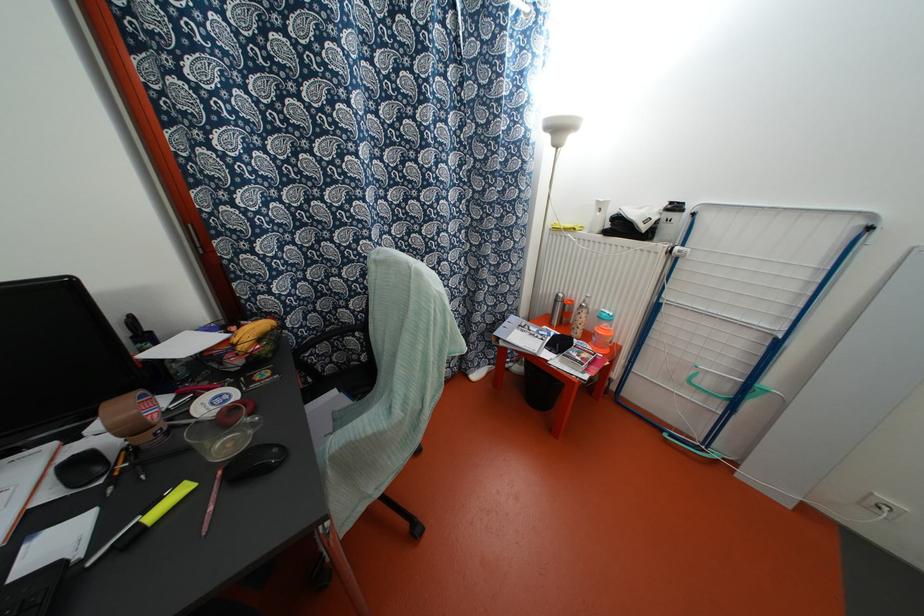
Where is `white water bottle`? This screenshot has width=924, height=616. white water bottle is located at coordinates (599, 216).